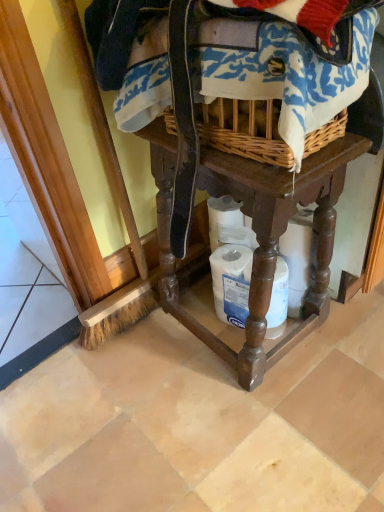
Question: From a real-world perspective, is white matte toilet paper at lower center positioned above or below brown wooden table at center?

Choices:
 (A) above
 (B) below

Answer: (B)

Question: Considering the positions of white matte toilet paper at lower center and brown wooden table at center in the image, is white matte toilet paper at lower center wider or thinner than brown wooden table at center?

Choices:
 (A) wide
 (B) thin

Answer: (B)

Question: Estimate the real-world distances between objects in this image. Which object is closer to the woven fabric at upper center?

Choices:
 (A) brown wooden table at center
 (B) white matte toilet paper at lower center

Answer: (A)

Question: Which object is the closest to the brown wooden table at center?

Choices:
 (A) white matte toilet paper at lower center
 (B) woven fabric at upper center

Answer: (A)